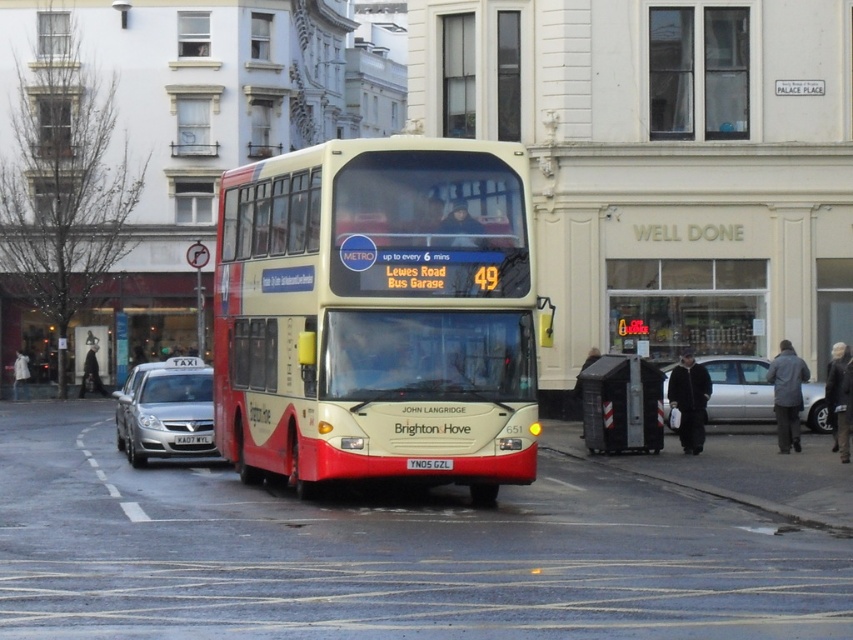
You are standing at the silver metallic taxi at left and want to reach the bus stop located at the opposite side of the road. The road is 20 meters wide. Can you safely cross the road within the marked crosswalk before the Brighton and Hove bus arrives?

The silver metallic taxi at left and viewer are 24.93 meters apart from each other. Since the road is 20 meters wide, you can safely cross the road within the marked crosswalk before the Brighton and Hove bus arrives.

Looking at this image, you are a pedestrian standing at the metallic gray bus stop at lower right. You want to cross the road to reach the silver metallic sedan at center. Is the sedan behind or in front of the bus stop?

The metallic gray bus stop at lower right is in front of the silver metallic sedan at center, so the sedan is behind the bus stop.